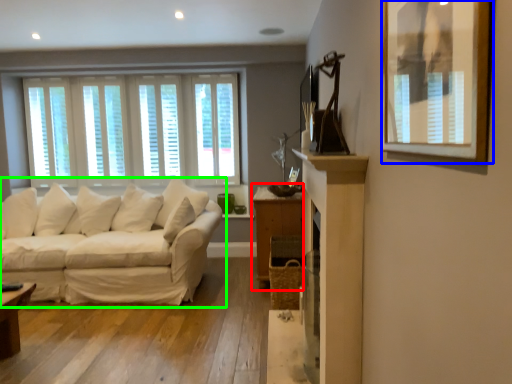
Question: Estimate the real-world distances between objects in this image. Which object is closer to dresser (highlighted by a red box), picture frame (highlighted by a blue box) or studio couch (highlighted by a green box)?

Choices:
 (A) picture frame
 (B) studio couch

Answer: (B)